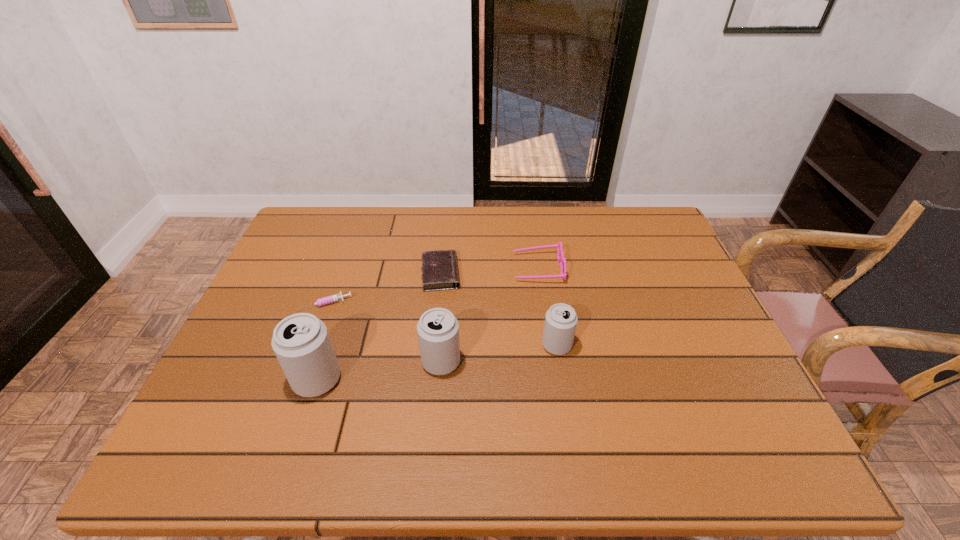
The height and width of the screenshot is (540, 960). I want to click on unoccupied position between the fifth tallest object and the tallest object, so click(x=379, y=327).

Identify the location of empty space between the fifth tallest object and the fourth tallest object. (489, 271).

This screenshot has width=960, height=540. What are the coordinates of `object that stands as the third closest to the shortest object` in the screenshot? It's located at (x=438, y=329).

Locate an element on the screen. This screenshot has height=540, width=960. the closest object to the third tallest object is located at coordinates (561, 259).

At what (x,y) coordinates should I click in order to perform the action: click on can that is the third nearest to the diary. Please return your answer as a coordinate pair (x, y). Image resolution: width=960 pixels, height=540 pixels. Looking at the image, I should click on (301, 342).

Identify the location of the closest can to the tallest can. (438, 329).

Image resolution: width=960 pixels, height=540 pixels. Find the location of `vacant position in the image that satisfies the following two spatial constraints: 1. on the back side of the leftmost can; 2. on the right side of the shortest can`. vacant position in the image that satisfies the following two spatial constraints: 1. on the back side of the leftmost can; 2. on the right side of the shortest can is located at coordinates (328, 345).

The height and width of the screenshot is (540, 960). Find the location of `free space that satisfies the following two spatial constraints: 1. on the back side of the tallest object; 2. on the right side of the third tallest object`. free space that satisfies the following two spatial constraints: 1. on the back side of the tallest object; 2. on the right side of the third tallest object is located at coordinates (328, 345).

Find the location of `vacant space that satisfies the following two spatial constraints: 1. on the arms of the fourth tallest object; 2. on the front side of the diary`. vacant space that satisfies the following two spatial constraints: 1. on the arms of the fourth tallest object; 2. on the front side of the diary is located at coordinates (539, 273).

Locate an element on the screen. This screenshot has width=960, height=540. free space that satisfies the following two spatial constraints: 1. on the back side of the tallest can; 2. on the right side of the third tallest object is located at coordinates (328, 345).